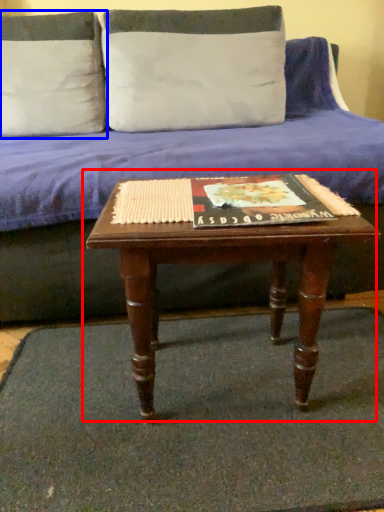
Question: Which point is closer to the camera, coffee table (highlighted by a red box) or pillow (highlighted by a blue box)?

Choices:
 (A) coffee table
 (B) pillow

Answer: (A)